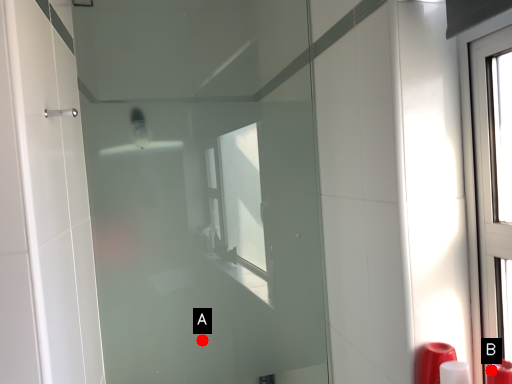
Question: Two points are circled on the image, labeled by A and B beside each circle. Which point appears closest to the camera in this image?

Choices:
 (A) A is closer
 (B) B is closer

Answer: (B)